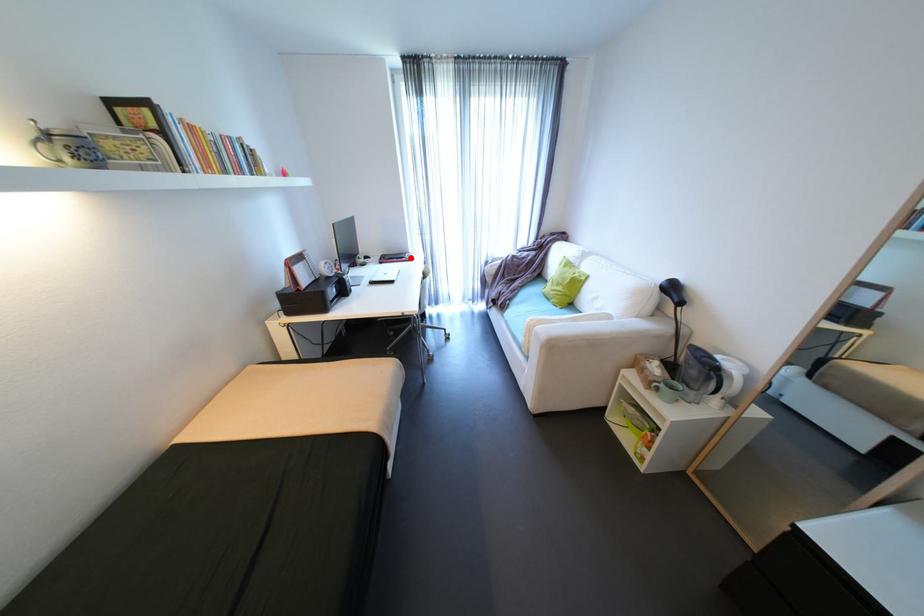
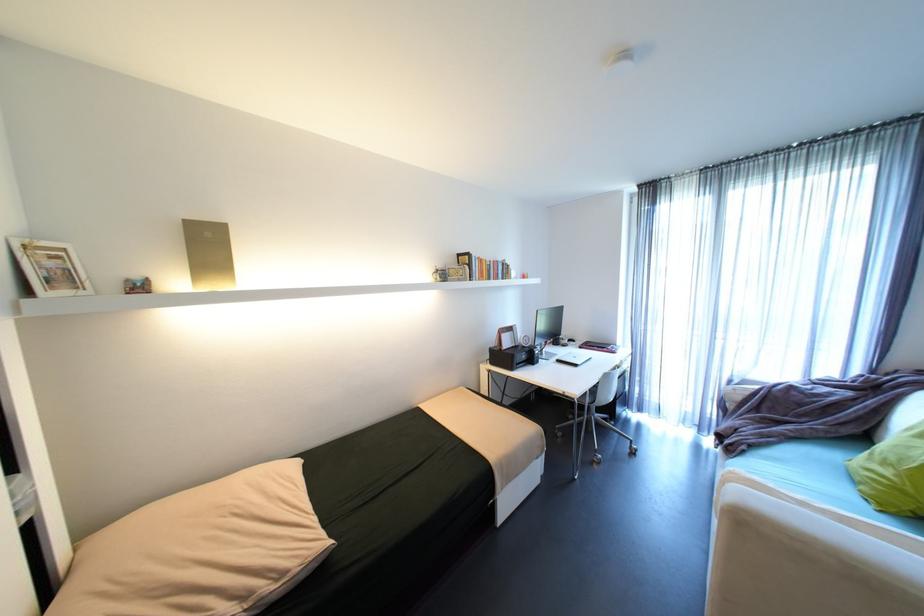
The point at the highlighted location is marked in the first image. Where is the corresponding point in the second image?

(612, 347)